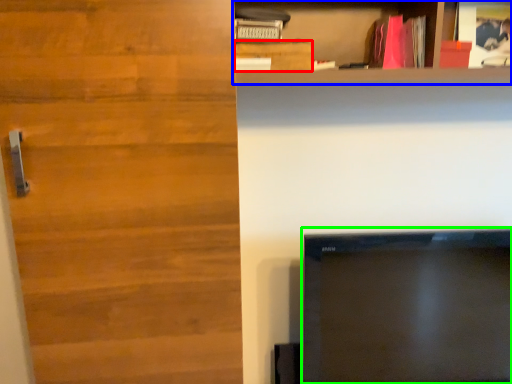
Question: Which is farther away from cabinetry (highlighted by a red box)? shelf (highlighted by a blue box) or television (highlighted by a green box)?

Choices:
 (A) shelf
 (B) television

Answer: (B)